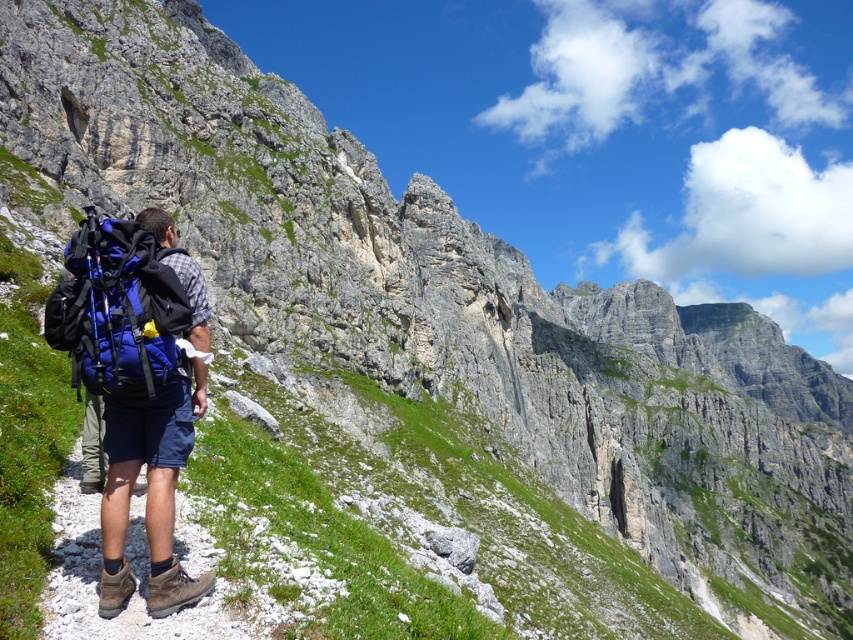
You are the hiker in the image and you want to check your backpack. Which blue fabric backpack at left or blue fabric backpack at center is closer to you?

The blue fabric backpack at left is closer to you because it is in front of the blue fabric backpack at center.